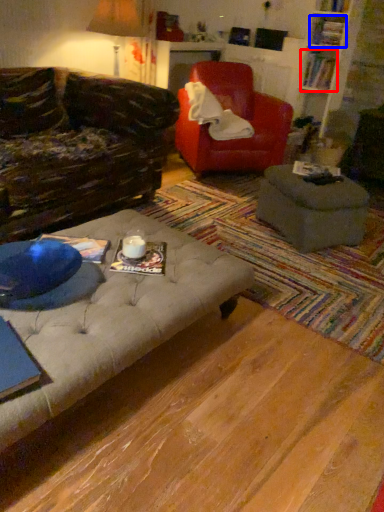
Question: Which of the following is the closest to the observer, book (highlighted by a red box) or book (highlighted by a blue box)?

Choices:
 (A) book
 (B) book

Answer: (B)